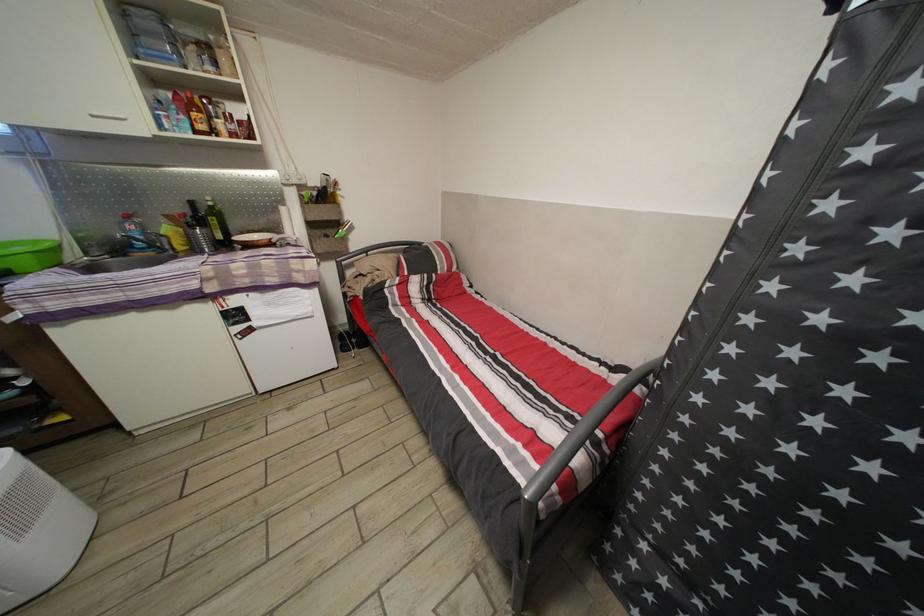
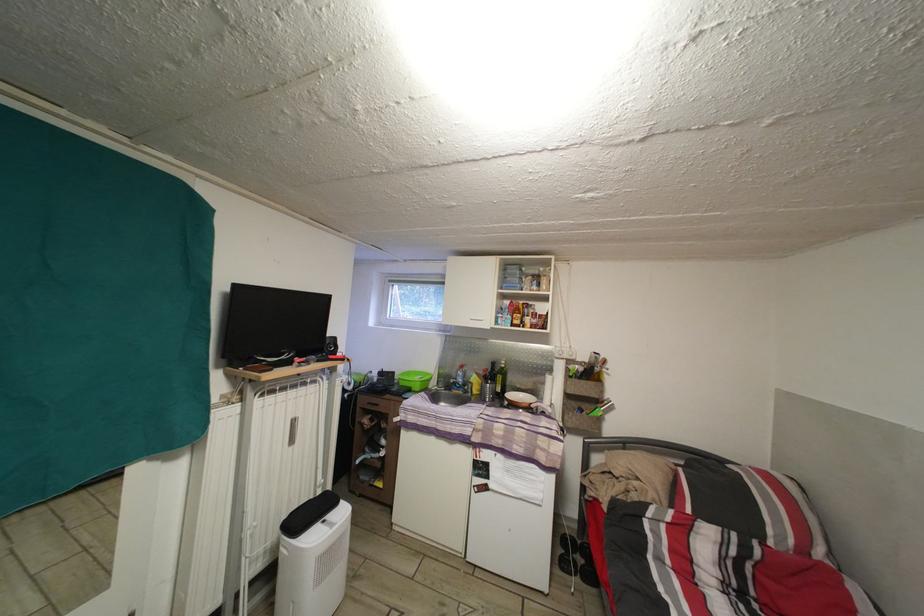
First-person continuous shooting, in which direction is the camera rotating?

The rotation direction of the camera is left-up.